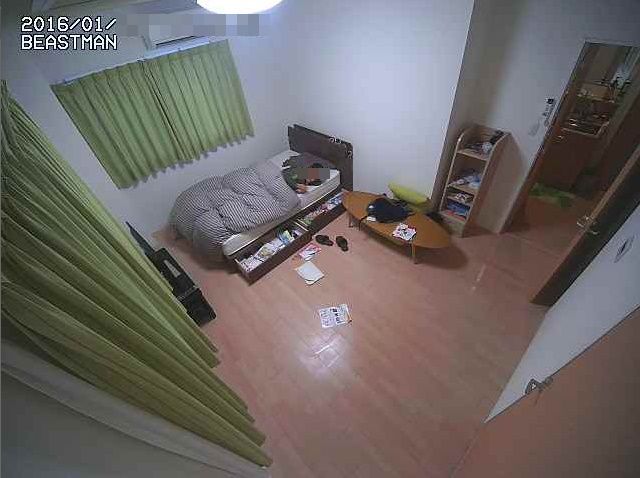
Identify the location of brown hardwood floor. (368, 382).